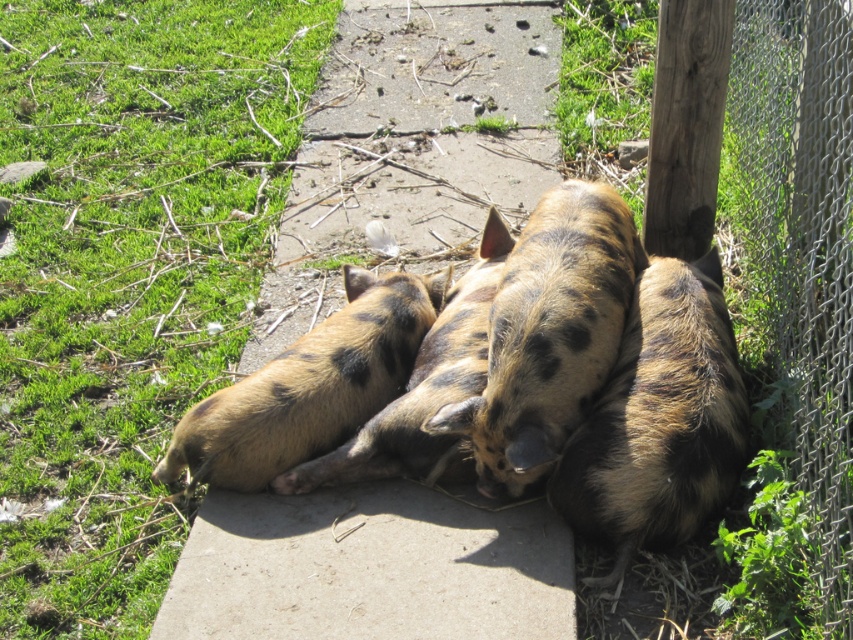
Question: Which object is farther from the camera taking this photo?

Choices:
 (A) spotted fur pig at center
 (B) green grass at lower left
 (C) speckled fur piglet at center
 (D) speckled fur pig at center

Answer: (C)

Question: Is spotted fur pig at center to the left of speckled fur piglet at center from the viewer's perspective?

Choices:
 (A) no
 (B) yes

Answer: (A)

Question: Which point is farther from the camera taking this photo?

Choices:
 (A) (1, 32)
 (B) (643, 465)
 (C) (486, 234)
 (D) (326, 429)

Answer: (A)

Question: Among these points, which one is nearest to the camera?

Choices:
 (A) (329, 346)
 (B) (18, 250)

Answer: (A)

Question: Is speckled fur pig at center smaller than speckled fur piglet at center?

Choices:
 (A) yes
 (B) no

Answer: (A)

Question: Can you confirm if speckled fur pig at center is wider than speckled fur piglet at center?

Choices:
 (A) no
 (B) yes

Answer: (A)